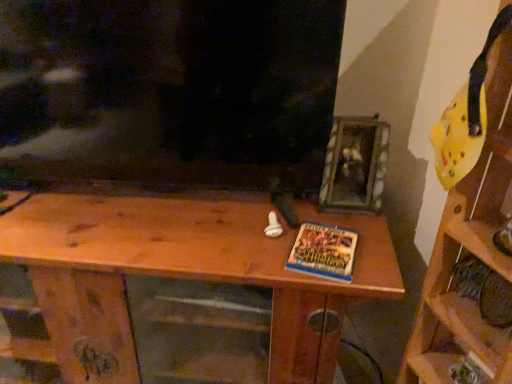
Locate an element on the screen. The width and height of the screenshot is (512, 384). free space to the left of blue glossy book at center is located at coordinates (255, 246).